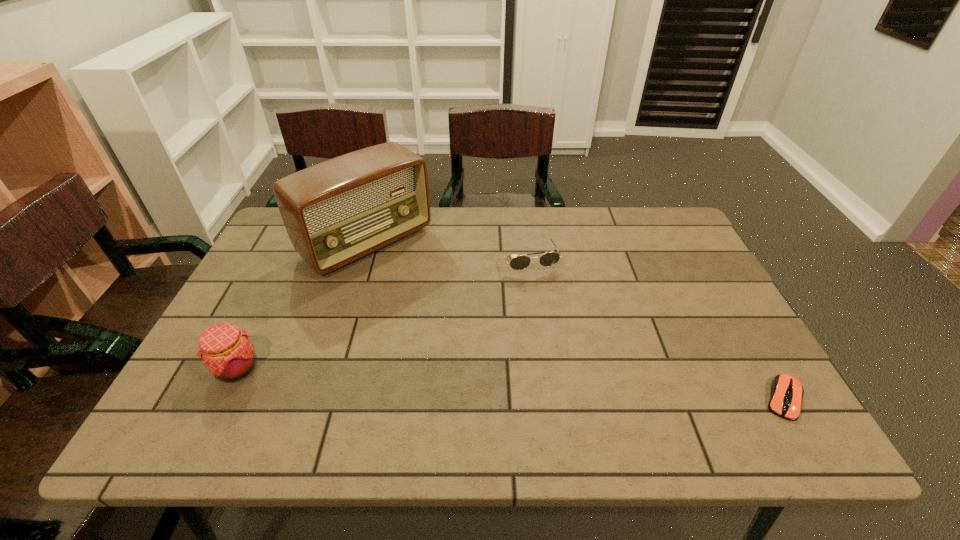
Find the location of a particular element. free point located on the front-facing side of the tallest object is located at coordinates point(494,354).

Find the location of a particular element. Image resolution: width=960 pixels, height=540 pixels. vacant space located 0.340m on the front lenses of the sunglasses is located at coordinates (578, 377).

Identify the location of free region located 0.240m on the front lenses of the sunglasses. The height and width of the screenshot is (540, 960). (564, 343).

At what (x,y) coordinates should I click in order to perform the action: click on free space located 0.270m on the front lenses of the sunglasses. Please return your answer as a coordinate pair (x, y). This screenshot has width=960, height=540. Looking at the image, I should click on [567, 353].

This screenshot has width=960, height=540. I want to click on radio receiver that is at the far edge, so click(335, 212).

I want to click on sunglasses that is positioned at the far edge, so click(548, 259).

The height and width of the screenshot is (540, 960). I want to click on jam present at the near edge, so click(x=227, y=352).

The image size is (960, 540). I want to click on computer mouse situated at the near edge, so click(787, 392).

Identify the location of jam situated at the left edge. The height and width of the screenshot is (540, 960). (227, 352).

I want to click on radio receiver at the left edge, so click(x=335, y=212).